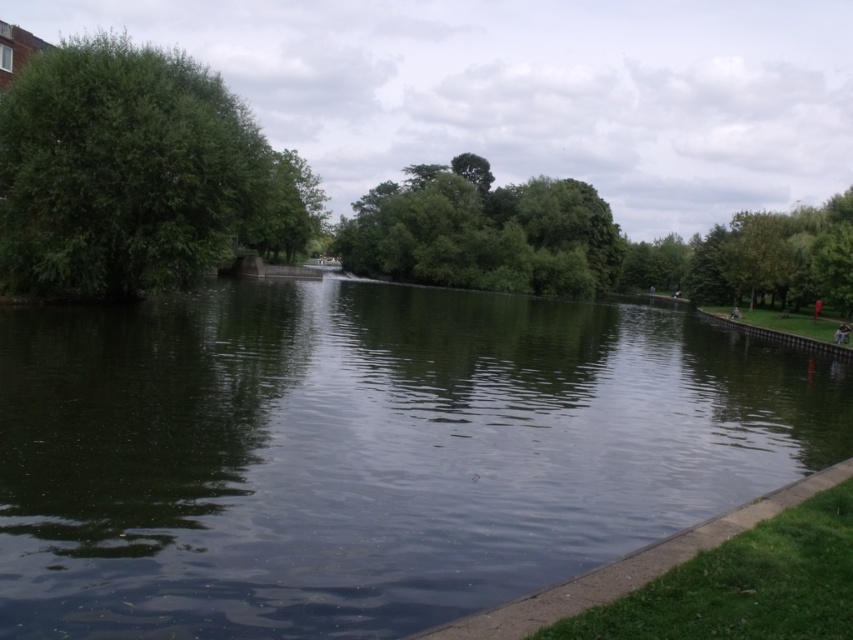
Question: Which of the following is the closest to the observer?

Choices:
 (A) green reflective water at center
 (B) green leafy trees at center

Answer: (A)

Question: Is green reflective water at center in front of green leafy tree at left?

Choices:
 (A) yes
 (B) no

Answer: (A)

Question: Which point is farther to the camera?

Choices:
 (A) green leafy trees at center
 (B) green reflective water at center
 (C) green leafy tree at left

Answer: (A)

Question: Estimate the real-world distances between objects in this image. Which object is farther from the green leafy tree at left?

Choices:
 (A) green reflective water at center
 (B) green leafy trees at center

Answer: (B)

Question: Can you confirm if green leafy tree at left is thinner than green leafy trees at center?

Choices:
 (A) yes
 (B) no

Answer: (B)

Question: Can you confirm if green reflective water at center is bigger than green leafy tree at left?

Choices:
 (A) no
 (B) yes

Answer: (A)